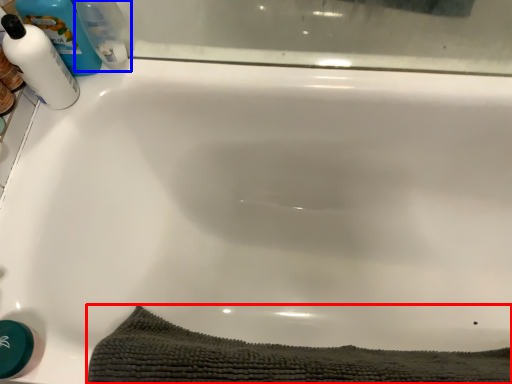
Question: Which object appears closest to the camera in this image, bath towel (highlighted by a red box) or cleaning product (highlighted by a blue box)?

Choices:
 (A) bath towel
 (B) cleaning product

Answer: (A)